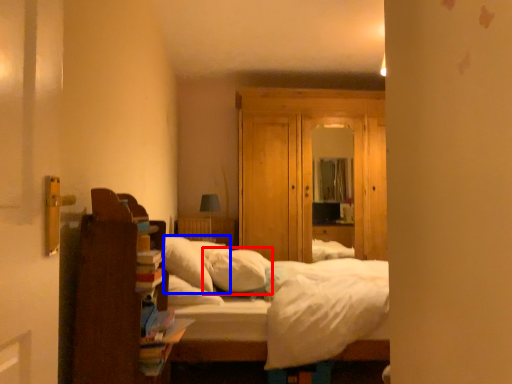
Question: Which object appears closest to the camera in this image, pillow (highlighted by a red box) or pillow (highlighted by a blue box)?

Choices:
 (A) pillow
 (B) pillow

Answer: (B)